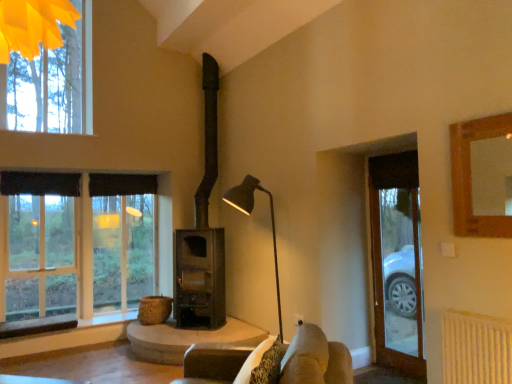
Question: From a real-world perspective, is matte glass window at left physically below matte black fireplace at center?

Choices:
 (A) yes
 (B) no

Answer: (A)

Question: Considering the relative sizes of matte glass window at left and matte black fireplace at center in the image provided, is matte glass window at left smaller than matte black fireplace at center?

Choices:
 (A) yes
 (B) no

Answer: (A)

Question: Is matte glass window at left far from matte black fireplace at center?

Choices:
 (A) no
 (B) yes

Answer: (B)

Question: Can you confirm if matte glass window at left is thinner than matte black fireplace at center?

Choices:
 (A) no
 (B) yes

Answer: (B)

Question: From the image's perspective, is matte glass window at left beneath matte black fireplace at center?

Choices:
 (A) yes
 (B) no

Answer: (A)

Question: Considering the relative sizes of matte glass window at left and matte black fireplace at center in the image provided, is matte glass window at left taller than matte black fireplace at center?

Choices:
 (A) yes
 (B) no

Answer: (B)

Question: Does matte glass window at left have a larger size compared to smooth stone table at center?

Choices:
 (A) yes
 (B) no

Answer: (A)

Question: Is matte glass window at left positioned in front of smooth stone table at center?

Choices:
 (A) no
 (B) yes

Answer: (A)

Question: Is matte glass window at left taller than smooth stone table at center?

Choices:
 (A) no
 (B) yes

Answer: (B)

Question: Is matte glass window at left facing towards smooth stone table at center?

Choices:
 (A) yes
 (B) no

Answer: (A)

Question: Is smooth stone table at center at the back of matte glass window at left?

Choices:
 (A) no
 (B) yes

Answer: (A)

Question: From the image's perspective, would you say matte glass window at left is shown under smooth stone table at center?

Choices:
 (A) no
 (B) yes

Answer: (A)

Question: Considering the relative sizes of clear glass door at right and black metal floor lamp at center in the image provided, is clear glass door at right smaller than black metal floor lamp at center?

Choices:
 (A) no
 (B) yes

Answer: (B)